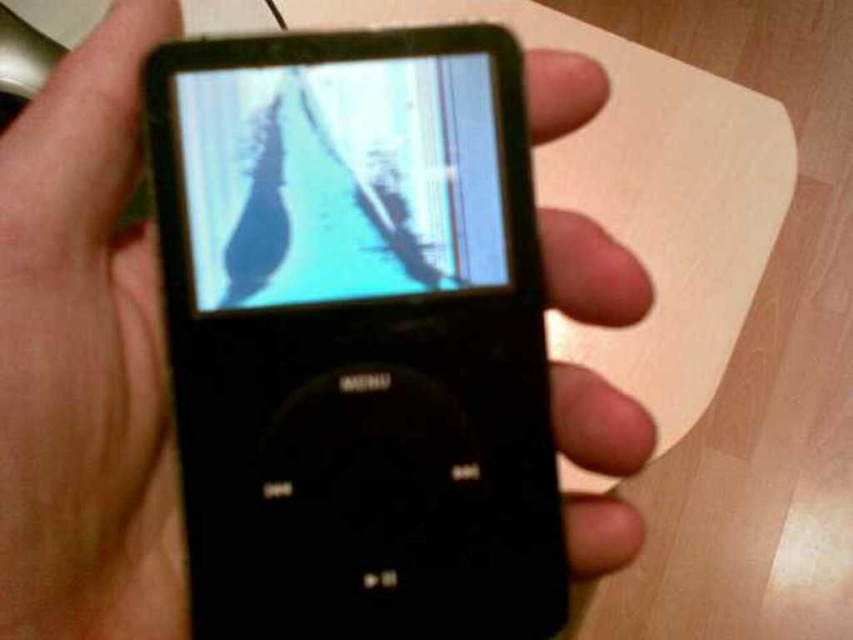
What are the coordinates of the black matte iPod at center in the image?

The coordinates of the black matte iPod at center are point (357, 336).

From the picture: What is the spatial relationship between the black matte ipod at center and the matte plastic screen at center?

The black matte ipod at center is to the right of the matte plastic screen at center.

You are a repair technician examining the black matte ipod at center and the matte plastic screen at center. Which object has a greater height?

The black matte ipod at center is taller than the matte plastic screen at center according to the description.